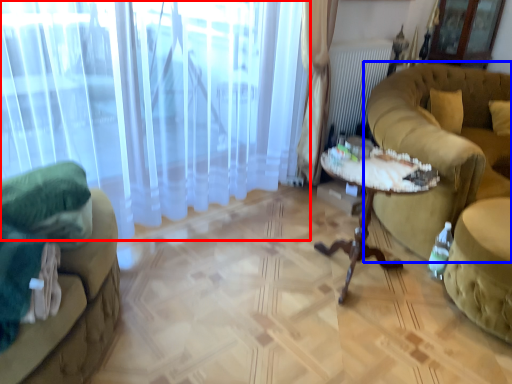
Question: Which object appears farthest to the camera in this image, curtain (highlighted by a red box) or studio couch (highlighted by a blue box)?

Choices:
 (A) curtain
 (B) studio couch

Answer: (B)